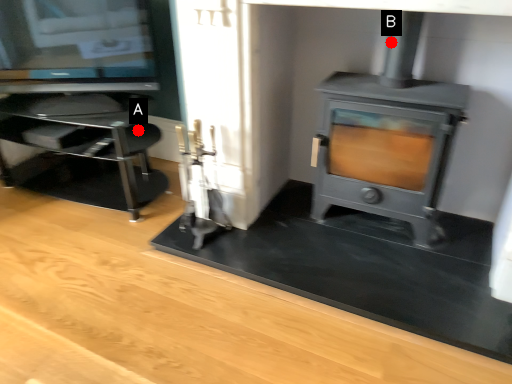
Question: Two points are circled on the image, labeled by A and B beside each circle. Which point is closer to the camera taking this photo?

Choices:
 (A) A is closer
 (B) B is closer

Answer: (B)